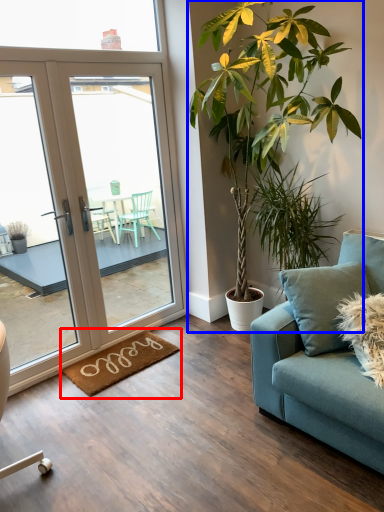
Question: Which point is closer to the camera, mat (highlighted by a red box) or houseplant (highlighted by a blue box)?

Choices:
 (A) mat
 (B) houseplant

Answer: (B)